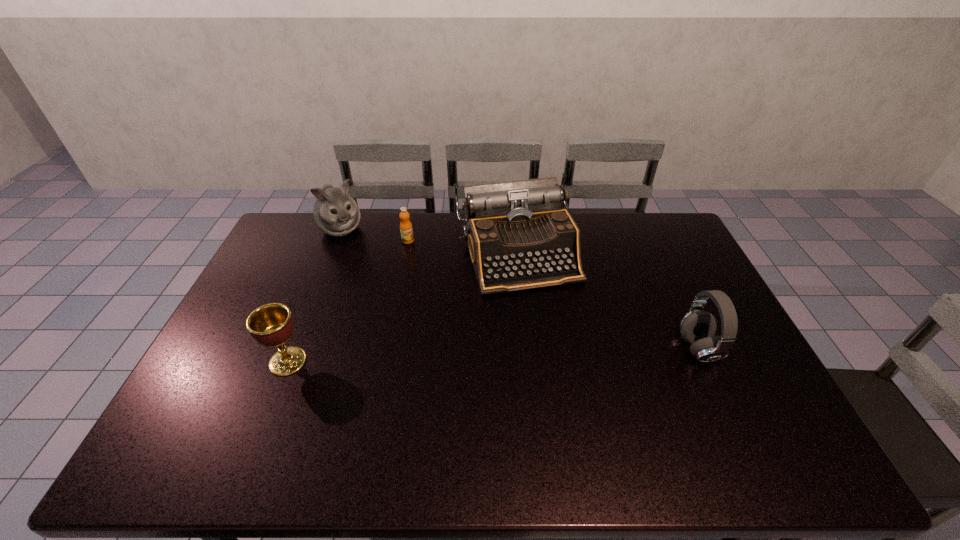
You are a GUI agent. You are given a task and a screenshot of the screen. Output one action in this format:
    pyautogui.click(x=<x>, y=<y>)
    Task: Click on the orange juice that is at the far edge
    The height and width of the screenshot is (540, 960).
    Given the screenshot: What is the action you would take?
    pyautogui.click(x=406, y=230)

Find the location of a particular element. The image size is (960, 540). hamster positioned at the far edge is located at coordinates [335, 213].

Where is `object that is at the left edge`? object that is at the left edge is located at coordinates click(x=335, y=213).

At what (x,y) coordinates should I click in order to perform the action: click on object situated at the right edge. Please return your answer as a coordinate pair (x, y). This screenshot has width=960, height=540. Looking at the image, I should click on (698, 327).

I want to click on object that is at the far left corner, so click(335, 213).

Where is `free spot at the far edge of the desktop`? free spot at the far edge of the desktop is located at coordinates (390, 215).

You are a GUI agent. You are given a task and a screenshot of the screen. Output one action in this format:
    pyautogui.click(x=<x>, y=<y>)
    Task: Click on the free space at the near edge of the desktop
    
    Given the screenshot: What is the action you would take?
    pyautogui.click(x=707, y=421)

The image size is (960, 540). In order to click on vacant space at the left edge of the desktop in this screenshot , I will do `click(219, 361)`.

Find the location of a particular element. vacant area that lies between the orange juice and the headset is located at coordinates (553, 295).

Locate an element on the screen. This screenshot has width=960, height=540. free space that is in between the rightmost object and the chalice is located at coordinates (493, 355).